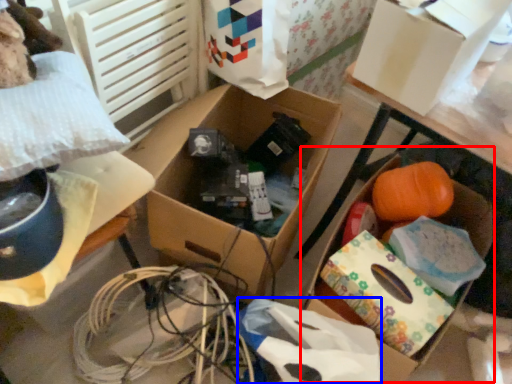
Question: Which object is closer to the camera taking this photo, storage box (highlighted by a red box) or wrapping paper (highlighted by a blue box)?

Choices:
 (A) storage box
 (B) wrapping paper

Answer: (B)